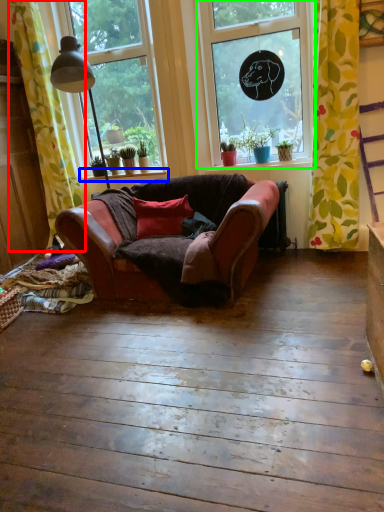
Question: Based on their relative distances, which object is nearer to curtain (highlighted by a red box)? Choose from window sill (highlighted by a blue box) and window (highlighted by a green box).

Choices:
 (A) window sill
 (B) window

Answer: (A)